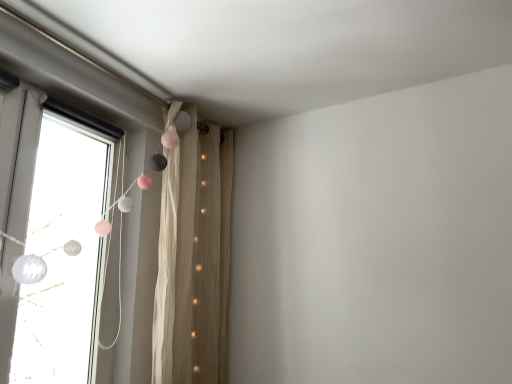
This screenshot has height=384, width=512. What do you see at coordinates (50, 240) in the screenshot?
I see `white matte curtain at left` at bounding box center [50, 240].

What is the approximate width of white matte curtain at left?

white matte curtain at left is 5.45 inches in width.

The width and height of the screenshot is (512, 384). I want to click on white matte curtain at left, so click(x=50, y=240).

What do you see at coordinates (193, 257) in the screenshot?
I see `beige textured curtain at upper left` at bounding box center [193, 257].

You are a GUI agent. You are given a task and a screenshot of the screen. Output one action in this format:
    pyautogui.click(x=<x>, y=<y>)
    Task: Click on the beige textured curtain at upper left
    The height and width of the screenshot is (384, 512).
    Given the screenshot: What is the action you would take?
    pyautogui.click(x=193, y=257)

You are a GUI agent. You are given a task and a screenshot of the screen. Output one action in this format:
    pyautogui.click(x=<x>, y=<y>)
    Task: Click on the white matte curtain at left
    The width and height of the screenshot is (512, 384).
    Given the screenshot: What is the action you would take?
    pyautogui.click(x=50, y=240)

Looking at this image, considering the positions of objects beige textured curtain at upper left and white matte curtain at left in the image provided, who is more to the right, beige textured curtain at upper left or white matte curtain at left?

beige textured curtain at upper left.

Is beige textured curtain at upper left positioned in front of white matte curtain at left?

No, beige textured curtain at upper left is behind white matte curtain at left.

Does point (230, 197) appear closer or farther from the camera than point (35, 357)?

Point (230, 197) appears to be closer to the viewer than point (35, 357).

From the image's perspective, who appears lower, beige textured curtain at upper left or white matte curtain at left?

From the image's view, beige textured curtain at upper left is below.

From a real-world perspective, which object stands above the other?

white matte curtain at left.

In terms of width, does beige textured curtain at upper left look wider or thinner when compared to white matte curtain at left?

In the image, beige textured curtain at upper left appears to be wider than white matte curtain at left.

Considering the sizes of objects beige textured curtain at upper left and white matte curtain at left in the image provided, who is taller, beige textured curtain at upper left or white matte curtain at left?

Standing taller between the two is beige textured curtain at upper left.

Which of these two, beige textured curtain at upper left or white matte curtain at left, is bigger?

Bigger between the two is white matte curtain at left.

Is beige textured curtain at upper left not inside white matte curtain at left?

Yes.

Is beige textured curtain at upper left placed right next to white matte curtain at left?

beige textured curtain at upper left and white matte curtain at left are not in contact.

Is beige textured curtain at upper left oriented towards white matte curtain at left?

No, beige textured curtain at upper left is not oriented towards white matte curtain at left.

How much distance is there between beige textured curtain at upper left and white matte curtain at left?

beige textured curtain at upper left and white matte curtain at left are 21.23 inches apart from each other.

This screenshot has height=384, width=512. What are the coordinates of `curtain that appears below the white matte curtain at left (from the image's perspective)` in the screenshot? It's located at (193, 257).

Which object is positioned more to the left, white matte curtain at left or beige textured curtain at upper left?

white matte curtain at left.

Considering the positions of objects white matte curtain at left and beige textured curtain at upper left in the image provided, who is behind, white matte curtain at left or beige textured curtain at upper left?

beige textured curtain at upper left is behind.

Is point (54, 191) positioned after point (204, 351)?

That is False.

From the image's perspective, which one is positioned lower, white matte curtain at left or beige textured curtain at upper left?

beige textured curtain at upper left, from the image's perspective.

From a real-world perspective, relative to beige textured curtain at upper left, is white matte curtain at left vertically above or below?

From a real-world perspective, white matte curtain at left is physically above beige textured curtain at upper left.

Considering the relative sizes of white matte curtain at left and beige textured curtain at upper left in the image provided, is white matte curtain at left thinner than beige textured curtain at upper left?

Indeed, white matte curtain at left has a lesser width compared to beige textured curtain at upper left.

Considering the sizes of objects white matte curtain at left and beige textured curtain at upper left in the image provided, who is taller, white matte curtain at left or beige textured curtain at upper left?

With more height is beige textured curtain at upper left.

In the scene shown: Considering the sizes of objects white matte curtain at left and beige textured curtain at upper left in the image provided, who is bigger, white matte curtain at left or beige textured curtain at upper left?

With larger size is white matte curtain at left.

Is beige textured curtain at upper left completely or partially inside white matte curtain at left?

Actually, beige textured curtain at upper left is outside white matte curtain at left.

Would you consider white matte curtain at left to be distant from beige textured curtain at upper left?

Actually, white matte curtain at left and beige textured curtain at upper left are a little close together.

From the picture: Is white matte curtain at left oriented away from beige textured curtain at upper left?

No, white matte curtain at left is not facing away from beige textured curtain at upper left.

Identify the location of window in front of the beige textured curtain at upper left. The image size is (512, 384). (50, 240).

Identify the location of curtain on the right side of white matte curtain at left. The height and width of the screenshot is (384, 512). (193, 257).

Find the location of a particular element. window in front of the beige textured curtain at upper left is located at coordinates (50, 240).